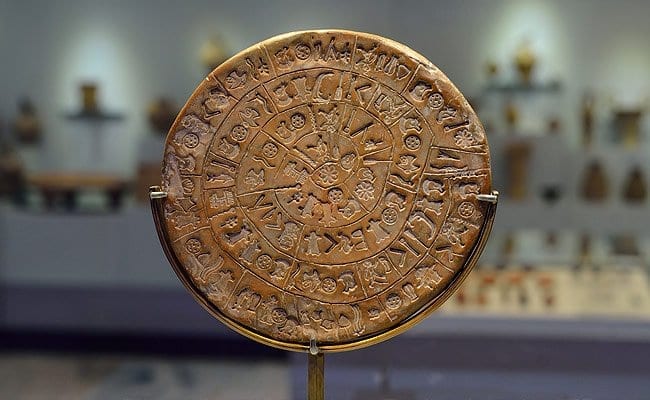
Image resolution: width=650 pixels, height=400 pixels. I want to click on shelves, so click(x=98, y=183), click(x=114, y=113), click(x=537, y=83).